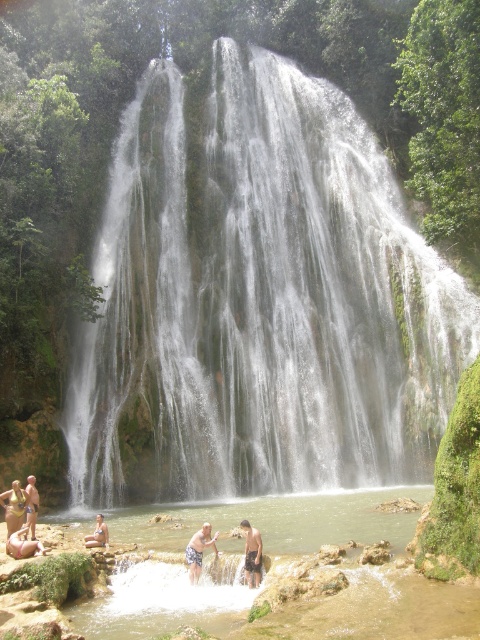
You are planning to take a photo of the beige sand person at lower left and the tan skin person at lower left from a distance. Which person will appear smaller in your photo?

The beige sand person at lower left will appear smaller in the photo because it has a lesser width compared to the tan skin person at lower left.

In the scene with the waterfall and pool, there are two people near the water. One is a tan skin human at lower center and the other is a tan skin human at lower left. Which of these two people is positioned higher up in the image?

The tan skin human at lower center is positioned higher up in the image than the tan skin human at lower left.